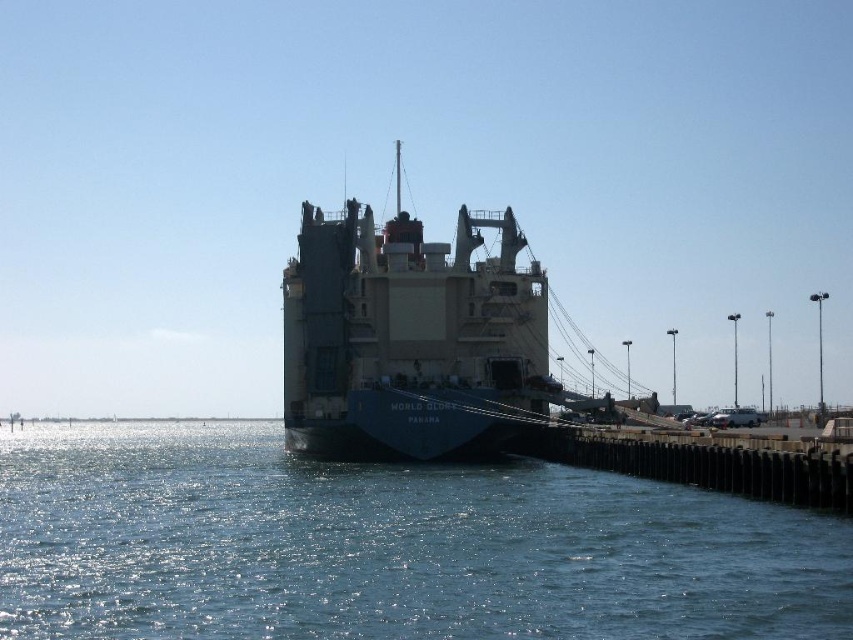
You are standing on the pier and want to take a photo of the blue water at lower left. According to the coordinates provided, where exactly should you aim your camera?

The blue water at lower left is located at coordinates point (387, 547), so you should aim your camera there.

You are a photographer trying to capture the green matte cargo ship at center and the blue water at lower left in a single shot. Which object should you focus on first if you want to ensure both are in frame without moving the camera?

The blue water at lower left has a smaller size compared to the green matte cargo ship at center, so you should focus on the larger green matte cargo ship at center first to ensure it fits in the frame, then adjust to include the smaller blue water at lower left.